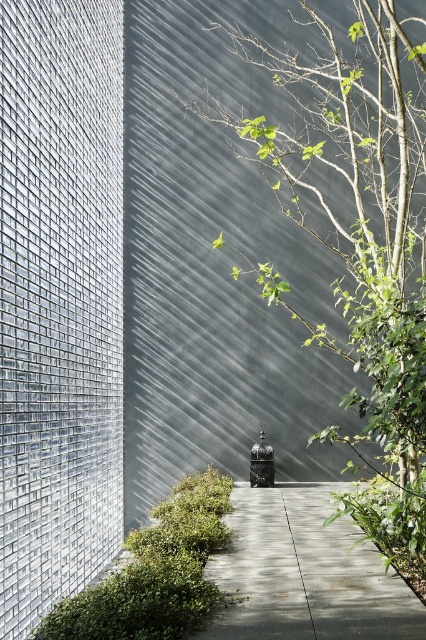
Is gray concrete path at center to the left of green leafy hedge at lower left from the viewer's perspective?

No, gray concrete path at center is not to the left of green leafy hedge at lower left.

Can you confirm if gray concrete path at center is smaller than green leafy hedge at lower left?

Correct, gray concrete path at center occupies less space than green leafy hedge at lower left.

Who is more distant from viewer, [324,609] or [69,600]?

Point [69,600]

I want to click on gray concrete path at center, so click(x=305, y=573).

Is green leafy tree at center positioned at the back of gray concrete path at center?

Yes, it is.

This screenshot has width=426, height=640. Describe the element at coordinates (360, 243) in the screenshot. I see `green leafy tree at center` at that location.

Between point (324, 192) and point (360, 554), which one is positioned behind?

The point (324, 192) is behind.

Identify the location of green leafy tree at center. The image size is (426, 640). (360, 243).

This screenshot has width=426, height=640. I want to click on green leafy tree at center, so click(360, 243).

Can you confirm if green leafy tree at center is positioned to the right of green leafy hedge at lower left?

Correct, you'll find green leafy tree at center to the right of green leafy hedge at lower left.

Does point (388, 44) come farther from viewer compared to point (115, 572)?

Yes, it is behind point (115, 572).

Locate an element on the screen. The image size is (426, 640). green leafy tree at center is located at coordinates (360, 243).